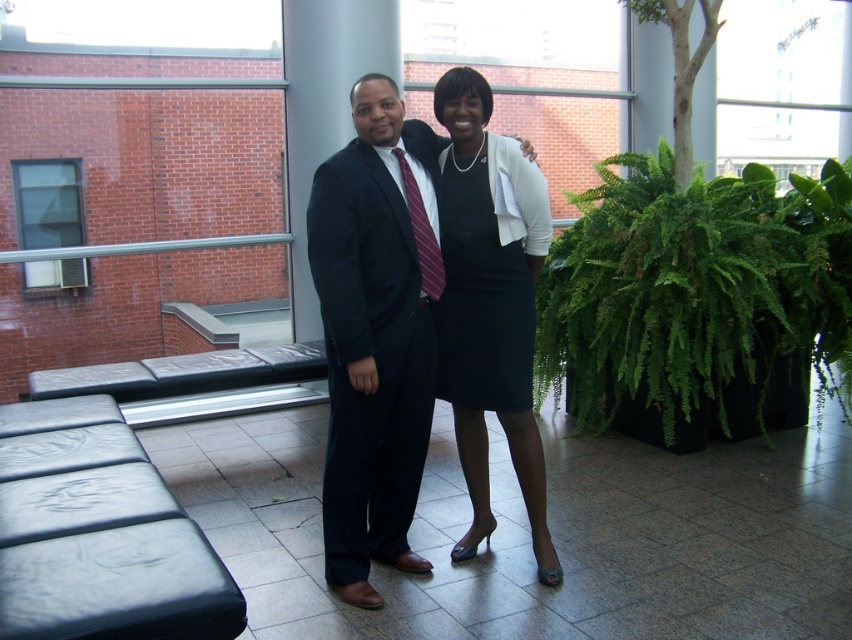
You are a photographer standing at the position where the viewer is. You want to take a closeup shot of the green leafy plant at right. Can you reach it without moving from your current position?

The green leafy plant at right and viewer are 3.47 meters apart, so you can reach it without moving from your current position if your camera has a zoom lens capable of focusing at that distance.